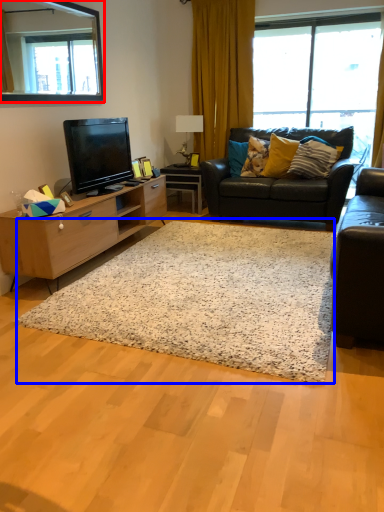
Question: Which of the following is the farthest to the observer, mirror (highlighted by a red box) or plain (highlighted by a blue box)?

Choices:
 (A) mirror
 (B) plain

Answer: (A)